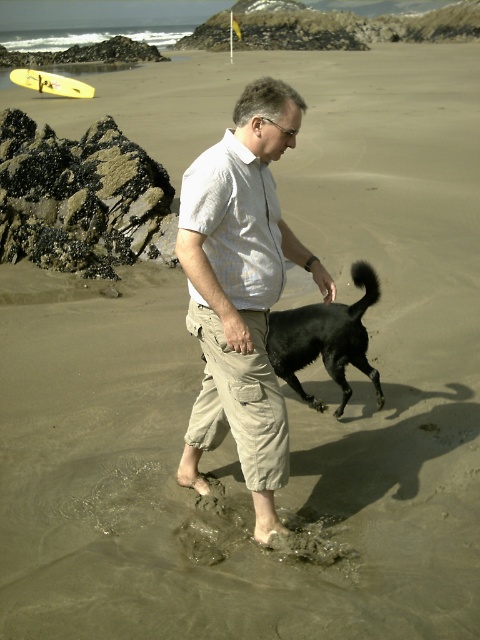
Which is more to the right, light beige cotton shirt at center or black matte dog at lower center?

Positioned to the right is black matte dog at lower center.

Which is above, light beige cotton shirt at center or black matte dog at lower center?

light beige cotton shirt at center is higher up.

Which is behind, point (201, 237) or point (301, 340)?

Positioned behind is point (301, 340).

You are a GUI agent. You are given a task and a screenshot of the screen. Output one action in this format:
    pyautogui.click(x=<x>, y=<y>)
    Task: Click on the light beige cotton shirt at center
    Image resolution: width=480 pixels, height=640 pixels.
    Given the screenshot: What is the action you would take?
    pyautogui.click(x=241, y=291)

Does point (190, 266) come closer to viewer compared to point (44, 35)?

Yes, point (190, 266) is in front of point (44, 35).

Who is lower down, light beige cotton shirt at center or clear water at upper left?

light beige cotton shirt at center is below.

Identify the location of light beige cotton shirt at center. (241, 291).

Based on the photo, is black matte dog at lower center thinner than clear water at upper left?

Yes.

Which is more to the right, black matte dog at lower center or clear water at upper left?

From the viewer's perspective, black matte dog at lower center appears more on the right side.

Does point (305, 401) lie in front of point (24, 32)?

Yes, point (305, 401) is in front of point (24, 32).

Identify the location of black matte dog at lower center. The width and height of the screenshot is (480, 640). (325, 339).